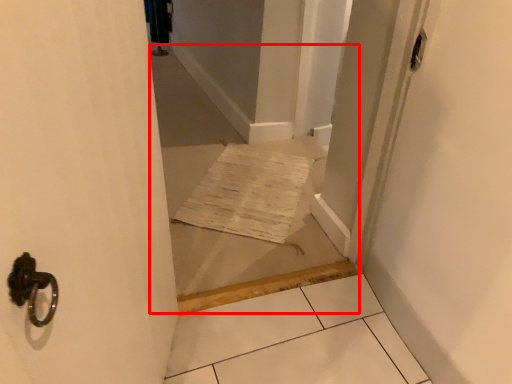
Question: In this image, where is corridor (annotated by the red box) located relative to screen door?

Choices:
 (A) left
 (B) right

Answer: (A)